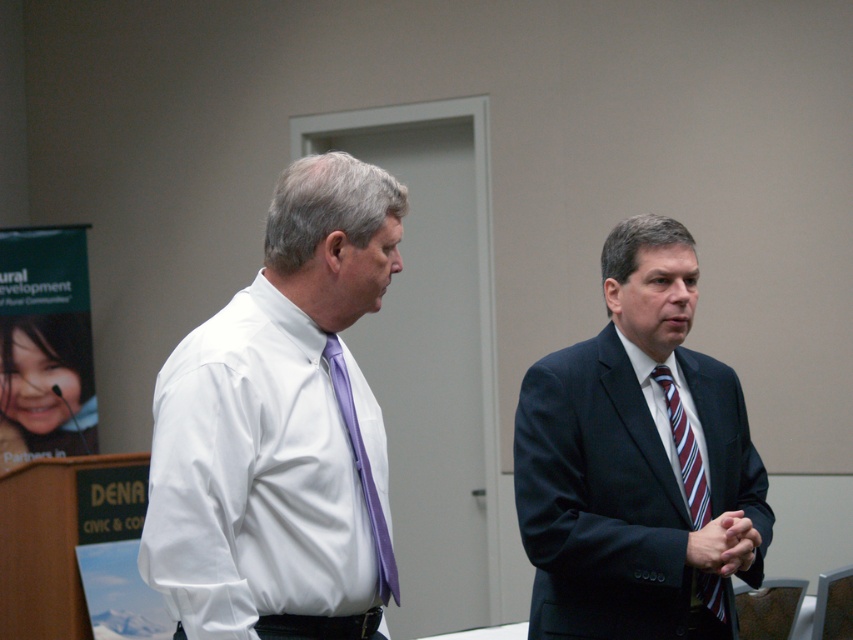
You are a photographer setting up for a group photo in the conference room. You need to position two subjects so that their shirts and ties are visible. The first subject is wearing a white smooth shirt at left and the second is wearing a purple silk tie at center. According to the scene, which subject is positioned further to the left?

The white smooth shirt at left is positioned further to the left than the purple silk tie at center, so the first subject wearing the white smooth shirt at left is further left.